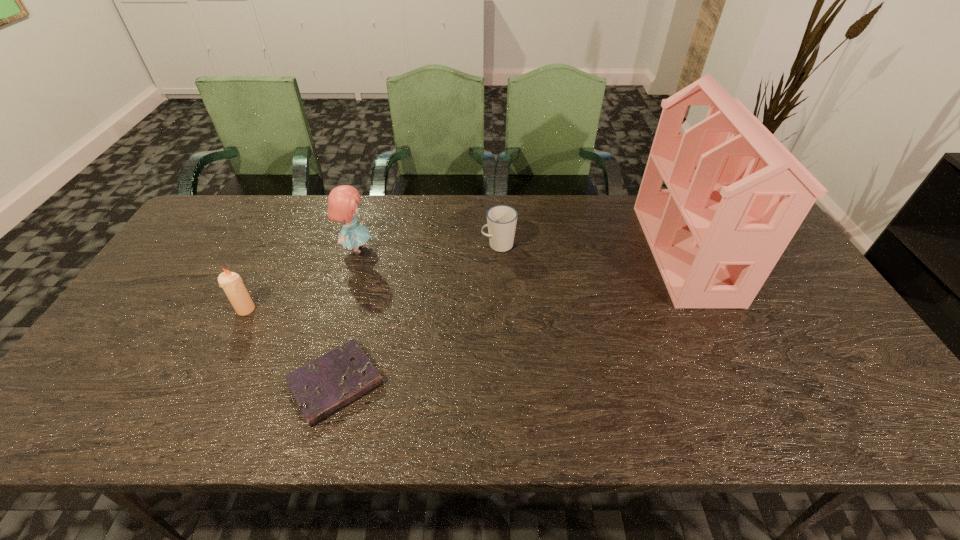
Locate an element on the screen. This screenshot has height=540, width=960. dollhouse is located at coordinates (736, 196).

Where is `the tallest object`? The image size is (960, 540). the tallest object is located at coordinates (736, 196).

Find the location of a particular element. The image size is (960, 540). doll is located at coordinates (342, 202).

Identify the location of the third tallest object. This screenshot has width=960, height=540. (231, 282).

Where is `candle`? The width and height of the screenshot is (960, 540). candle is located at coordinates (231, 282).

Image resolution: width=960 pixels, height=540 pixels. Find the location of `the fourth object from left to right`. the fourth object from left to right is located at coordinates (501, 220).

The height and width of the screenshot is (540, 960). What are the coordinates of `the second shortest object` in the screenshot? It's located at (501, 220).

Locate an element on the screen. diary is located at coordinates (321, 387).

Locate an element on the screen. the shortest object is located at coordinates (321, 387).

Find the location of `free space located 0.200m on the front-facing side of the tallest object`. free space located 0.200m on the front-facing side of the tallest object is located at coordinates (584, 253).